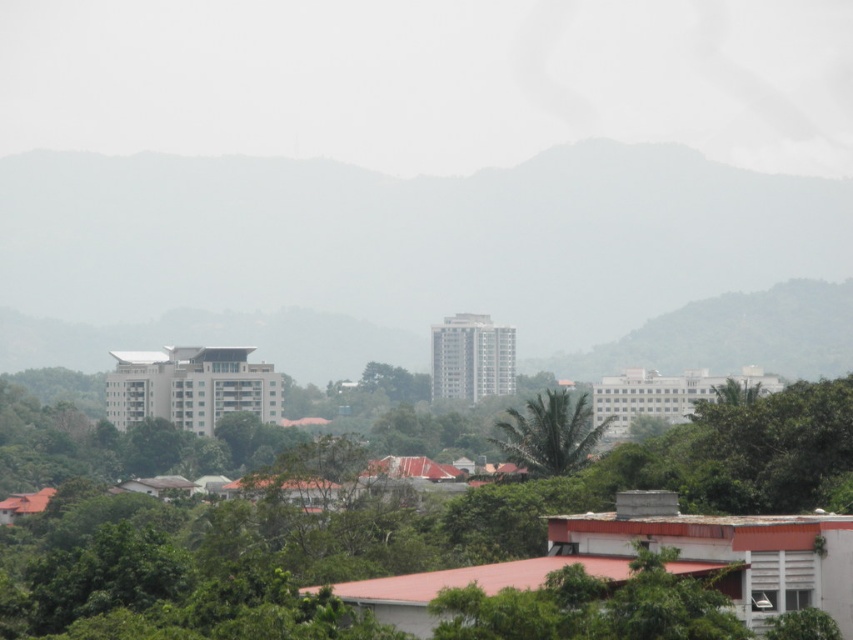
Question: Is green matte mountain at center further to the viewer compared to green leafy tree at center?

Choices:
 (A) no
 (B) yes

Answer: (B)

Question: Observing the image, what is the correct spatial positioning of green leafy tree at center in reference to green leafy palm at center?

Choices:
 (A) above
 (B) below

Answer: (B)

Question: Which object is closer to the camera taking this photo?

Choices:
 (A) green matte mountain at center
 (B) green leafy tree at center
 (C) green leafy palm at center

Answer: (B)

Question: Is green leafy tree at center to the right of green leafy palm at center from the viewer's perspective?

Choices:
 (A) yes
 (B) no

Answer: (B)

Question: Which point appears farthest from the camera in this image?

Choices:
 (A) (230, 612)
 (B) (556, 440)
 (C) (769, 198)

Answer: (C)

Question: Which object is positioned closest to the green leafy tree at center?

Choices:
 (A) green leafy palm at center
 (B) green matte mountain at center

Answer: (A)